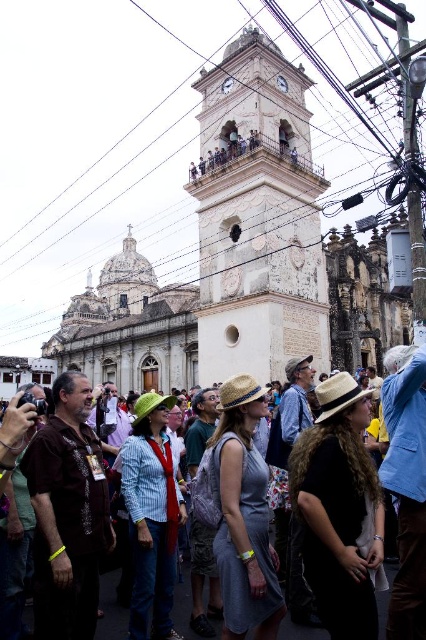
Does striped cotton shirt at center have a smaller size compared to strawmaterial/texturehat at center?

Incorrect, striped cotton shirt at center is not smaller in size than strawmaterial/texturehat at center.

Which of these two, striped cotton shirt at center or strawmaterial/texturehat at center, stands shorter?

Standing shorter between the two is strawmaterial/texturehat at center.

Who is more distant from viewer, (178, 515) or (359, 392)?

The point (178, 515) is more distant.

In order to click on striped cotton shirt at center in this screenshot , I will do `click(152, 515)`.

Can you confirm if white stone clock tower at center is shorter than black fabric hat at center?

No, white stone clock tower at center is not shorter than black fabric hat at center.

Is white stone clock tower at center to the right of black fabric hat at center from the viewer's perspective?

No, white stone clock tower at center is not to the right of black fabric hat at center.

This screenshot has width=426, height=640. I want to click on white stone clock tower at center, so click(258, 216).

Does denim jacket at center appear over strawtexturehat at center?

Incorrect, denim jacket at center is not positioned above strawtexturehat at center.

Which is more to the left, denim jacket at center or strawtexturehat at center?

denim jacket at center is more to the left.

Does point (117, 625) come farther from viewer compared to point (247, 397)?

No, (117, 625) is in front of (247, 397).

The width and height of the screenshot is (426, 640). Identify the location of denim jacket at center. (111, 611).